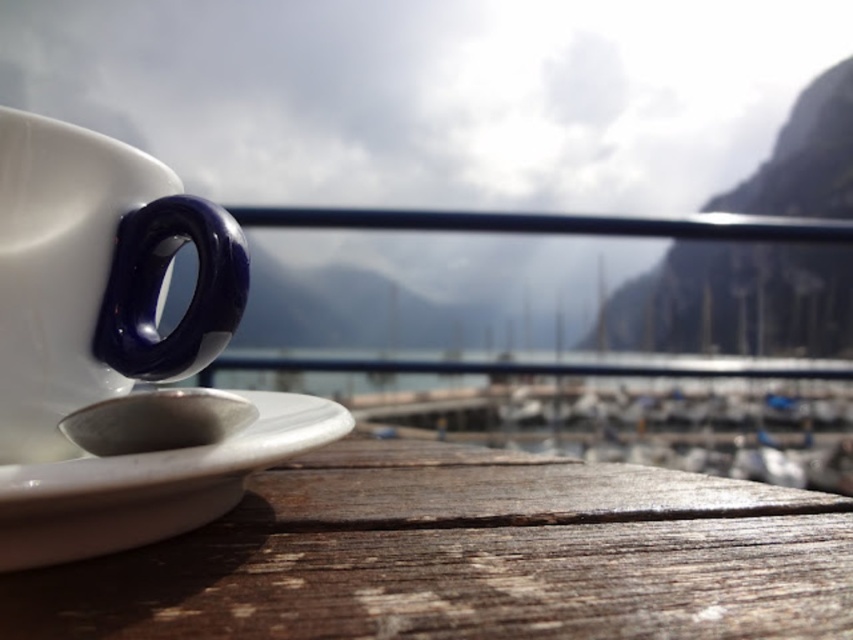
You are a small toy car that is 2 inches long. You are on the wooden table at lower left and want to move to the white glossy saucer at lower left. Can you fit through the space between them?

The wooden table at lower left is 2.41 inches away from the white glossy saucer at lower left. Since the toy car is 2 inches long, it can fit through the space between them as the distance is greater than the car length.